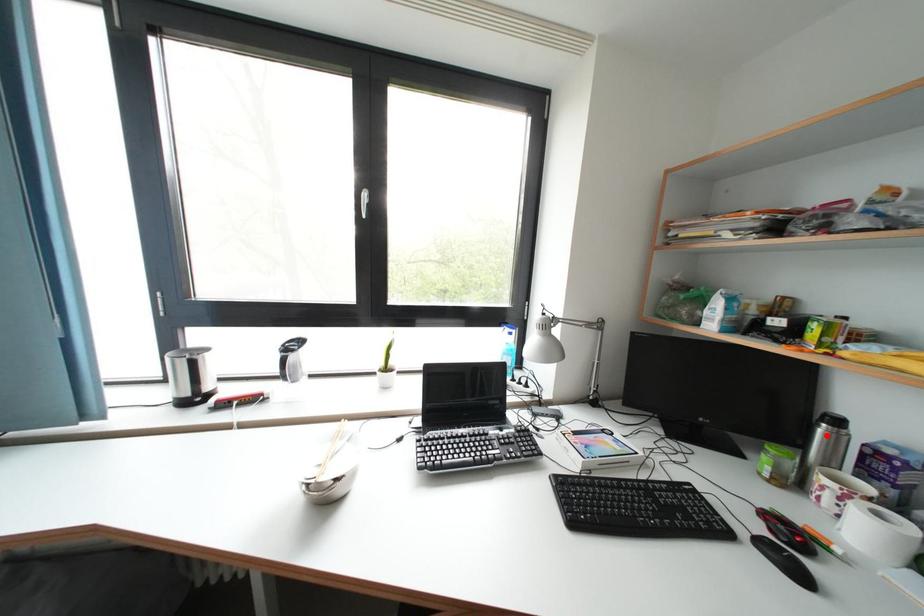
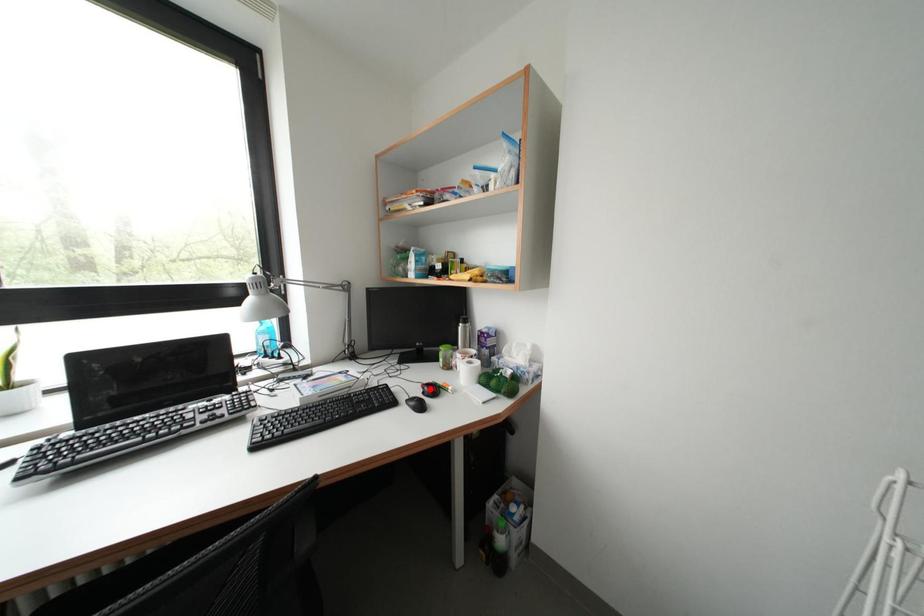
I am providing you with two images of the same scene from different viewpoints. A red point is marked on the first image and another point is marked on the second image. Are the points marked in image1 and image2 representing the same 3D position?

No